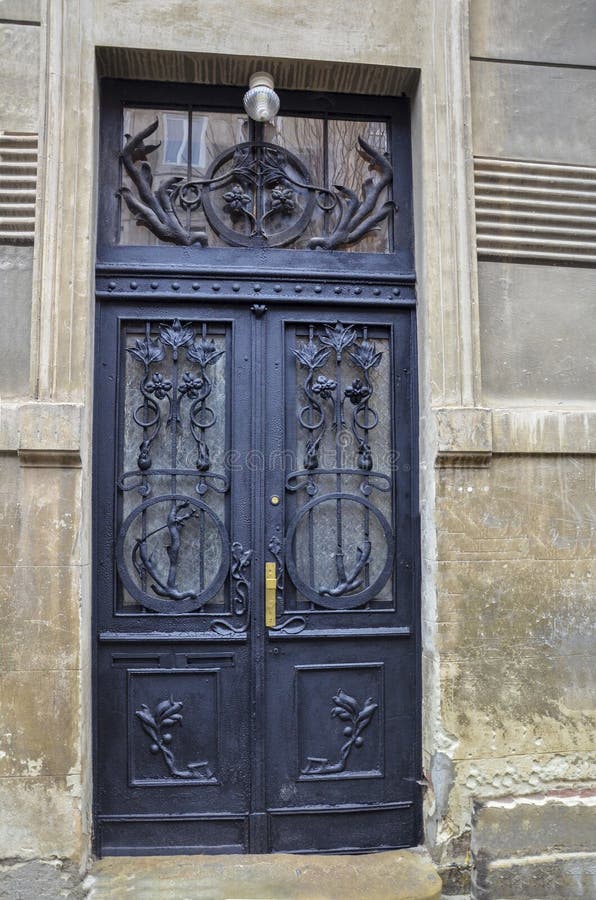
Identify the location of door step. (277, 875).